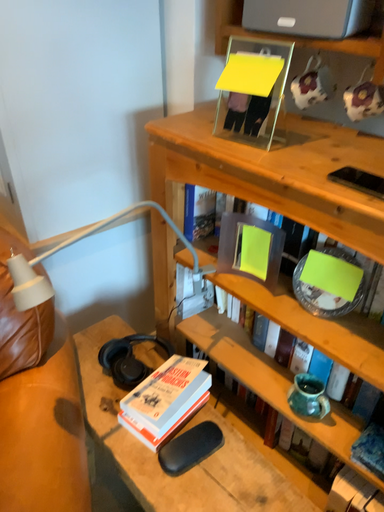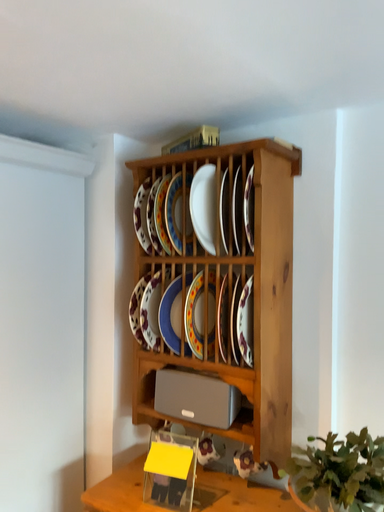
Question: How did the camera likely rotate when shooting the video?

Choices:
 (A) rotated upward
 (B) rotated downward

Answer: (A)